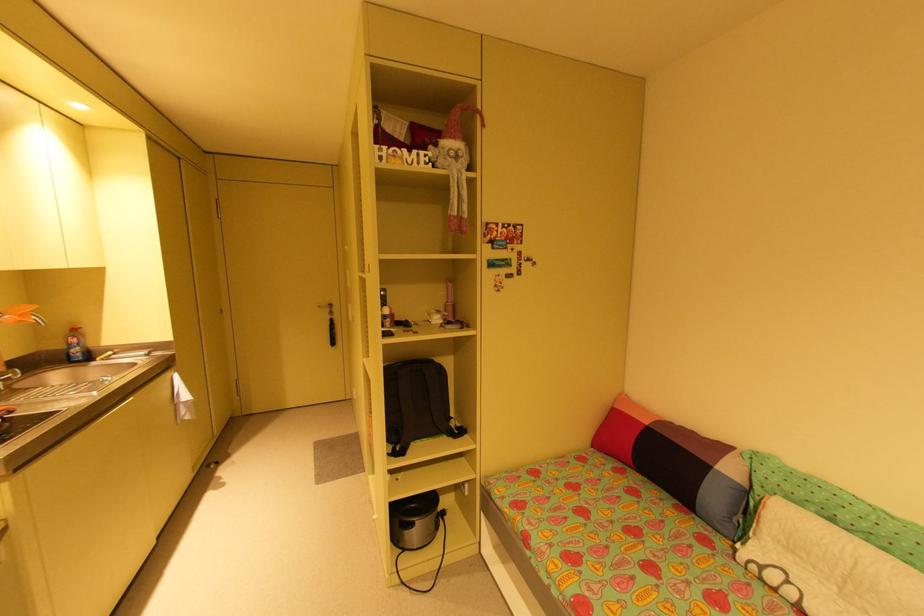
Find where to lift the backpack handle. Please return your answer as a coordinate pair (x, y).

(417, 403)